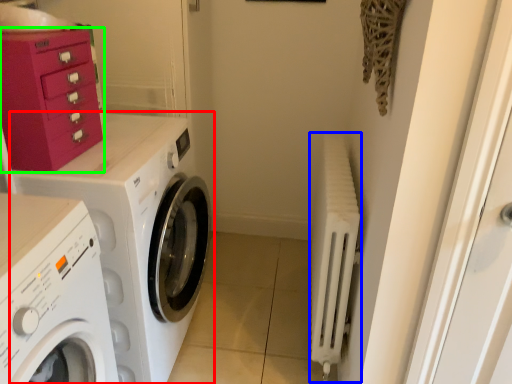
Question: Estimate the real-world distances between objects in this image. Which object is closer to washing machine (highlighted by a red box), radiator (highlighted by a blue box) or cabinetry (highlighted by a green box)?

Choices:
 (A) radiator
 (B) cabinetry

Answer: (B)